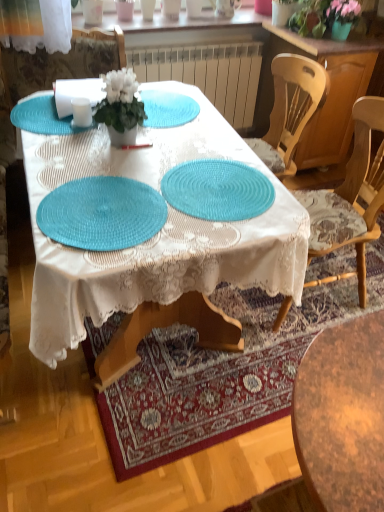
Find the location of `vacant space in white matte pot at center (from a real-world perspective)`. vacant space in white matte pot at center (from a real-world perspective) is located at coordinates (131, 140).